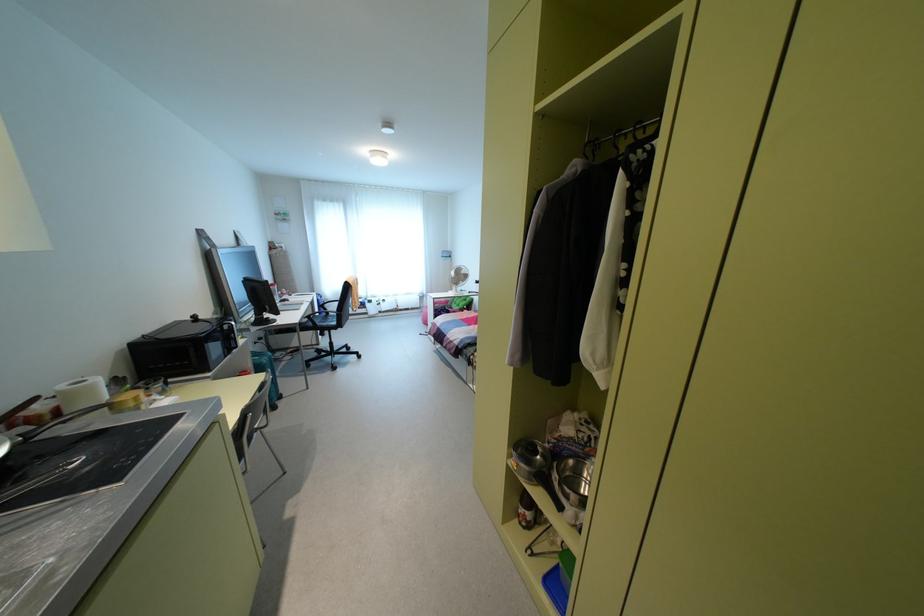
Find where to resting arm the black chair armrest. Please return your answer as a coordinate pair (x, y).

(322, 314)